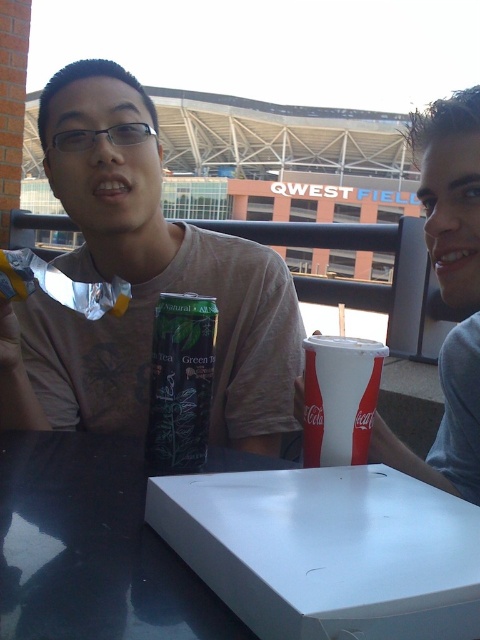
Question: Is green matte can at center positioned at the back of white glossy table at lower center?

Choices:
 (A) yes
 (B) no

Answer: (A)

Question: Estimate the real-world distances between objects in this image. Which object is farther from the white glossy table at lower center?

Choices:
 (A) green matte can at center
 (B) white paper cup at center
 (C) green matte tea bag at center

Answer: (A)

Question: Does white glossy table at lower center appear on the right side of green matte tea bag at center?

Choices:
 (A) yes
 (B) no

Answer: (B)

Question: Which of the following is the closest to the observer?

Choices:
 (A) (348, 461)
 (B) (121, 534)
 (C) (252, 321)

Answer: (B)

Question: Which point is closer to the camera?

Choices:
 (A) (355, 364)
 (B) (97, 93)
 (C) (159, 424)
 (D) (120, 490)

Answer: (D)

Question: Does white glossy table at lower center have a lesser width compared to green matte tea bag at center?

Choices:
 (A) no
 (B) yes

Answer: (A)